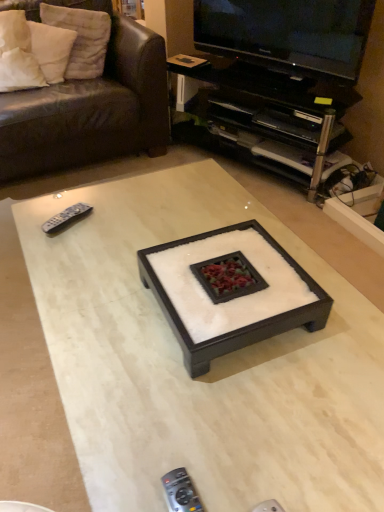
Identify the location of free area in between gray plastic remote at left, the first remote control viewed from the left, and white felt square tray at center, the 2th coffee table positioned from the bottom. (114, 261).